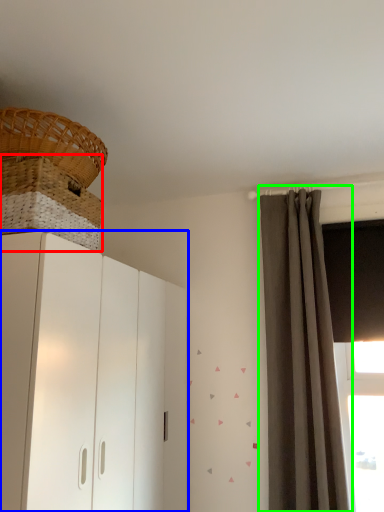
Question: Which object is positioned farthest from basket (highlighted by a red box)? Select from cupboard (highlighted by a blue box) and curtain (highlighted by a green box).

Choices:
 (A) cupboard
 (B) curtain

Answer: (B)